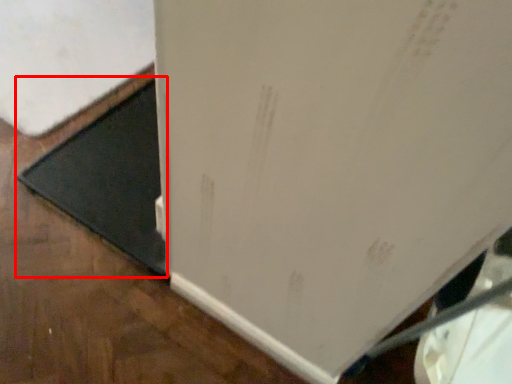
Question: From the image's perspective, what is the correct spatial positioning of doormat (annotated by the red box) in reference to refrigerator?

Choices:
 (A) above
 (B) below

Answer: (B)